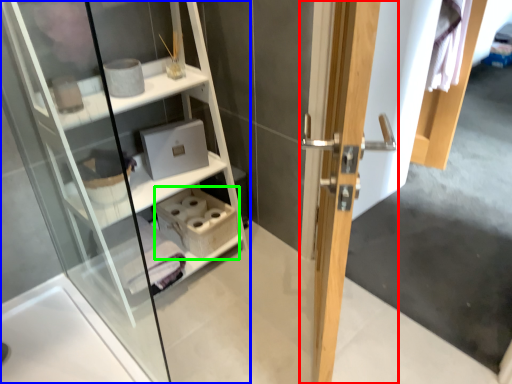
Question: Which object is positioned farthest from door (highlighted by a red box)? Select from shelf (highlighted by a blue box) and cabinet (highlighted by a green box).

Choices:
 (A) shelf
 (B) cabinet

Answer: (A)